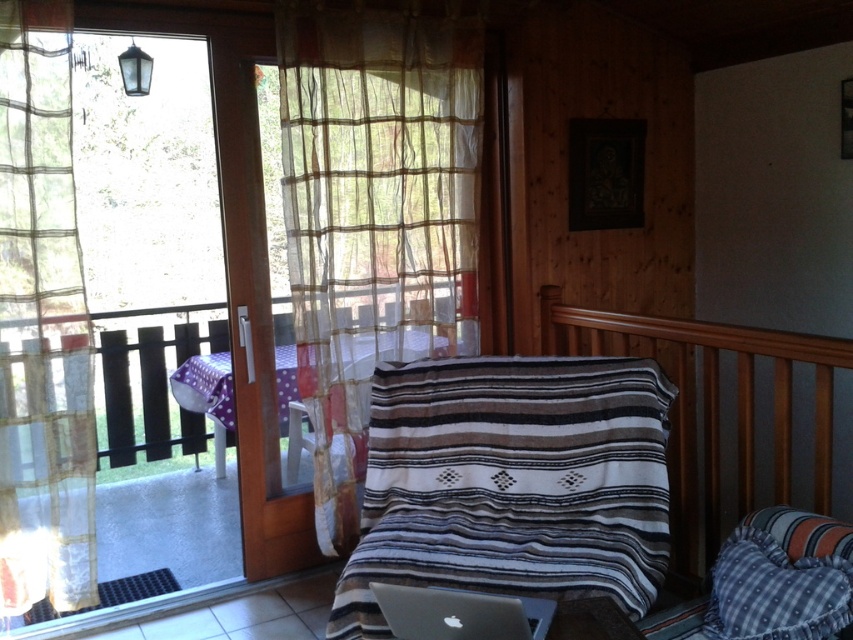
Between translucent sheer curtain at upper left and translucent sheer curtain at left, which one has more height?

translucent sheer curtain at upper left is taller.

Is translucent sheer curtain at upper left smaller than translucent sheer curtain at left?

No.

Between point (325, 145) and point (56, 26), which one is positioned behind?

The point (325, 145) is more distant.

Where is `translucent sheer curtain at upper left`? The image size is (853, 640). translucent sheer curtain at upper left is located at coordinates (374, 218).

Who is more forward, (25,364) or (566,337)?

Point (25,364) is more forward.

Which of these two, translucent sheer curtain at left or wooden rail at upper right, stands taller?

Standing taller between the two is translucent sheer curtain at left.

This screenshot has width=853, height=640. What do you see at coordinates (42, 323) in the screenshot?
I see `translucent sheer curtain at left` at bounding box center [42, 323].

The height and width of the screenshot is (640, 853). I want to click on translucent sheer curtain at left, so click(x=42, y=323).

In the scene shown: Between striped woven blanket at center and translucent sheer curtain at left, which one is positioned lower?

striped woven blanket at center

Based on the photo, is striped woven blanket at center to the right of translucent sheer curtain at left from the viewer's perspective?

Correct, you'll find striped woven blanket at center to the right of translucent sheer curtain at left.

Which is behind, point (613, 544) or point (51, 481)?

The point (51, 481) is more distant.

Find the location of `striped woven blanket at center`. striped woven blanket at center is located at coordinates (512, 483).